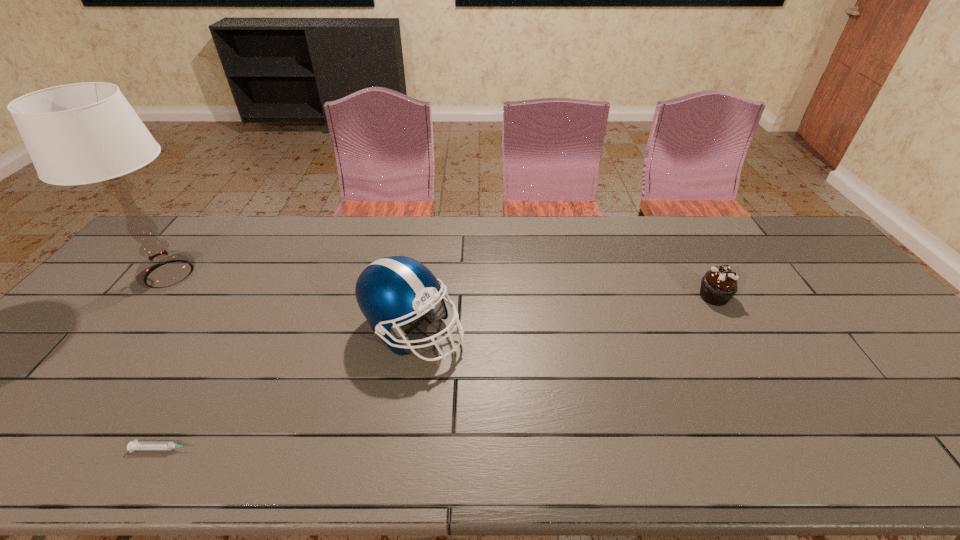
Identify the location of free space that satisfies the following two spatial constraints: 1. on the front-facing side of the rightmost object; 2. on the right side of the leftmost object. (151, 296).

Locate an element on the screen. vacant area that satisfies the following two spatial constraints: 1. on the front-facing side of the leftmost object; 2. on the left side of the rightmost object is located at coordinates (151, 296).

At what (x,y) coordinates should I click in order to perform the action: click on vacant region that satisfies the following two spatial constraints: 1. on the front side of the cupcake; 2. at the front of the third object from left to right with the faceguard. Please return your answer as a coordinate pair (x, y). Looking at the image, I should click on (733, 331).